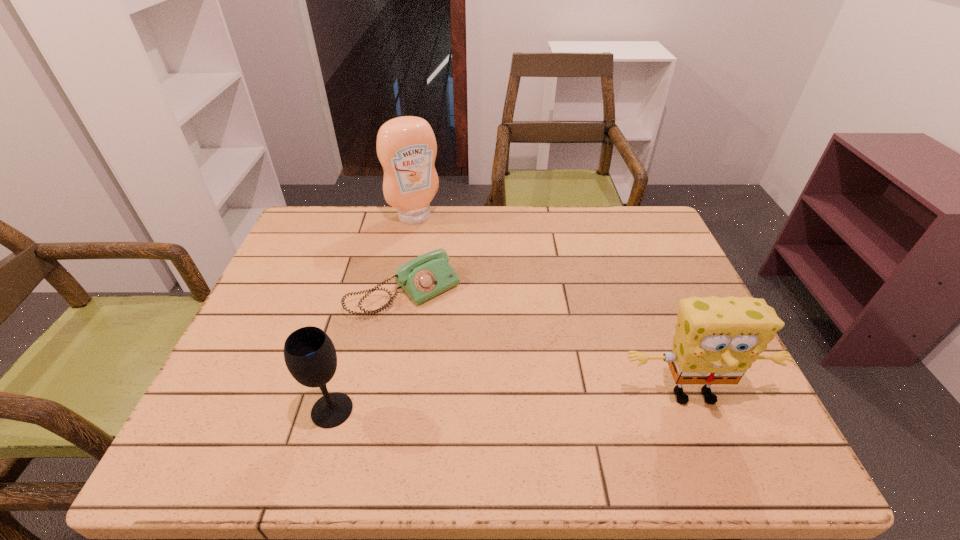
In order to click on free space on the desktop that is between the wineglass and the sponge and is positioned on the dial of the third nearest object in this screenshot , I will do `click(505, 403)`.

I want to click on vacant space on the desktop that is between the wineglass and the sponge and is positioned on the label of the condiment, so click(x=538, y=401).